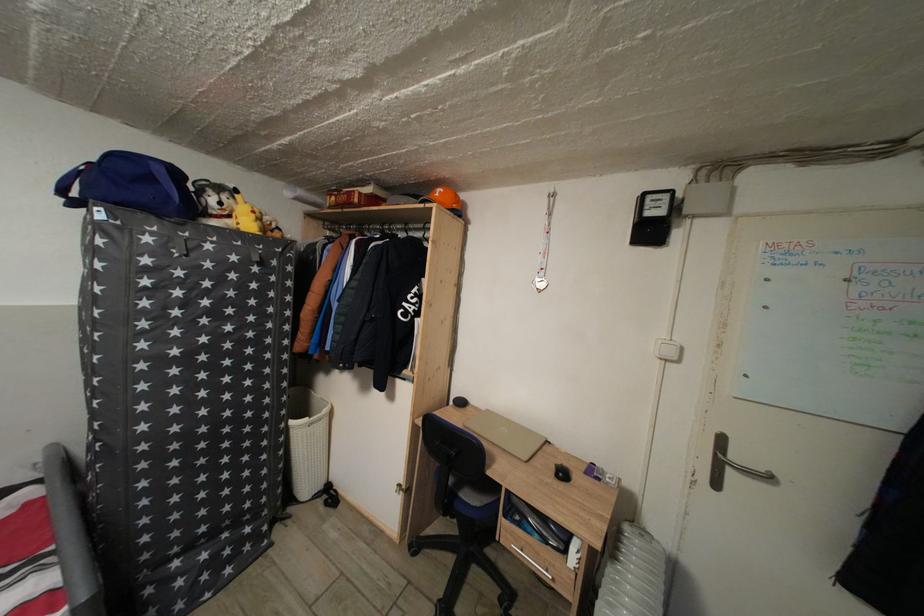
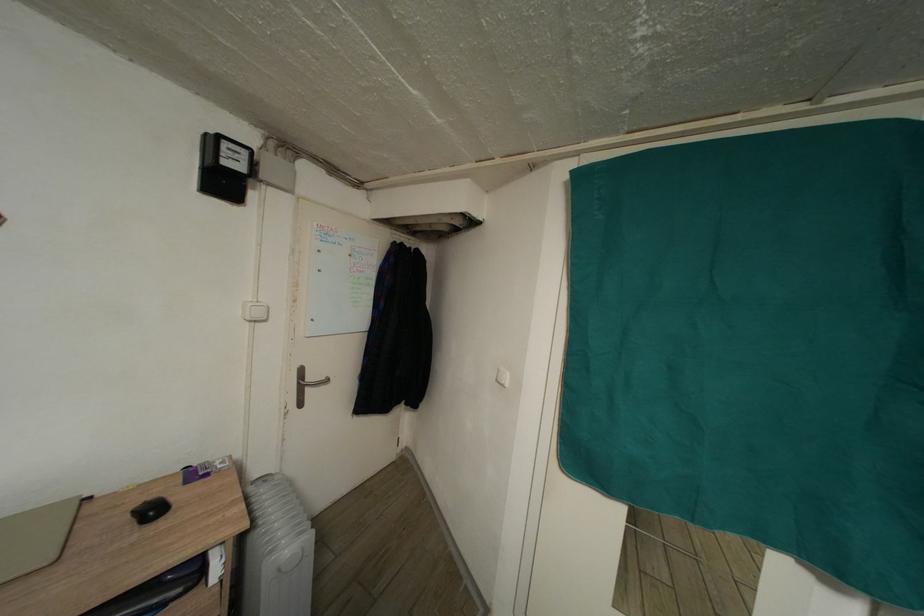
Question: The camera is either moving clockwise (left) or counter-clockwise (right) around the object. The first image is from the beginning of the video and the second image is from the end. Is the camera moving left or right when shooting the video?

Choices:
 (A) Left
 (B) Right

Answer: (A)